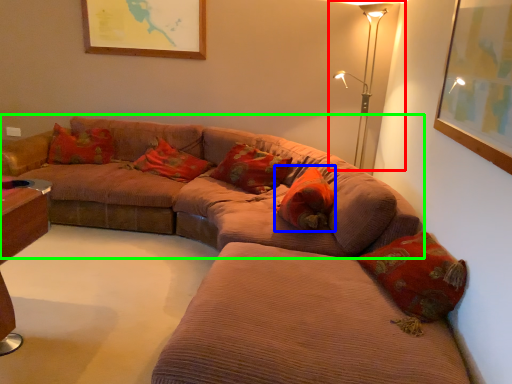
Question: Based on their relative distances, which object is nearer to table lamp (highlighted by a red box)? Choose from pillow (highlighted by a blue box) and studio couch (highlighted by a green box).

Choices:
 (A) pillow
 (B) studio couch

Answer: (A)